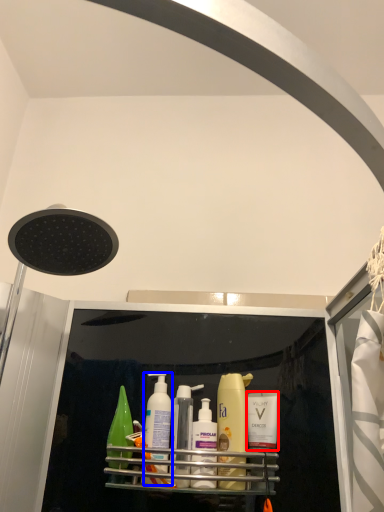
Question: Which object appears farthest to the camera in this image, toiletry (highlighted by a red box) or cleaning product (highlighted by a blue box)?

Choices:
 (A) toiletry
 (B) cleaning product

Answer: (A)